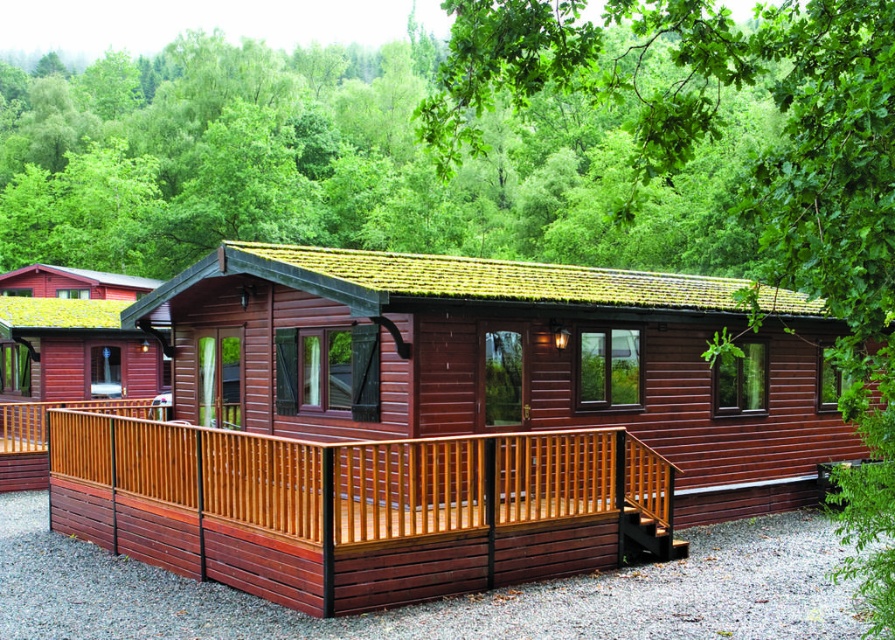
Is matte wood log cabin at center to the right of green leafy tree at upper center from the viewer's perspective?

No, matte wood log cabin at center is not to the right of green leafy tree at upper center.

Does matte wood log cabin at center appear on the left side of green leafy tree at upper center?

Yes, matte wood log cabin at center is to the left of green leafy tree at upper center.

Which is behind, point (454, 320) or point (495, 13)?

Positioned behind is point (454, 320).

This screenshot has width=895, height=640. Find the location of `matte wood log cabin at center`. matte wood log cabin at center is located at coordinates (505, 360).

Does wooden deck at lower center have a smaller size compared to green leafy tree at upper center?

Yes, wooden deck at lower center is smaller than green leafy tree at upper center.

This screenshot has width=895, height=640. What do you see at coordinates (358, 506) in the screenshot? I see `wooden deck at lower center` at bounding box center [358, 506].

Does point (602, 564) lie behind point (457, 122)?

Yes.

At what (x,y) coordinates should I click in order to perform the action: click on wooden deck at lower center. Please return your answer as a coordinate pair (x, y). Image resolution: width=895 pixels, height=640 pixels. Looking at the image, I should click on (358, 506).

Between matte wood log cabin at center and wooden deck at lower center, which one appears on the right side from the viewer's perspective?

From the viewer's perspective, matte wood log cabin at center appears more on the right side.

Is point (840, 458) positioned before point (645, 497)?

That is False.

This screenshot has width=895, height=640. I want to click on matte wood log cabin at center, so click(x=505, y=360).